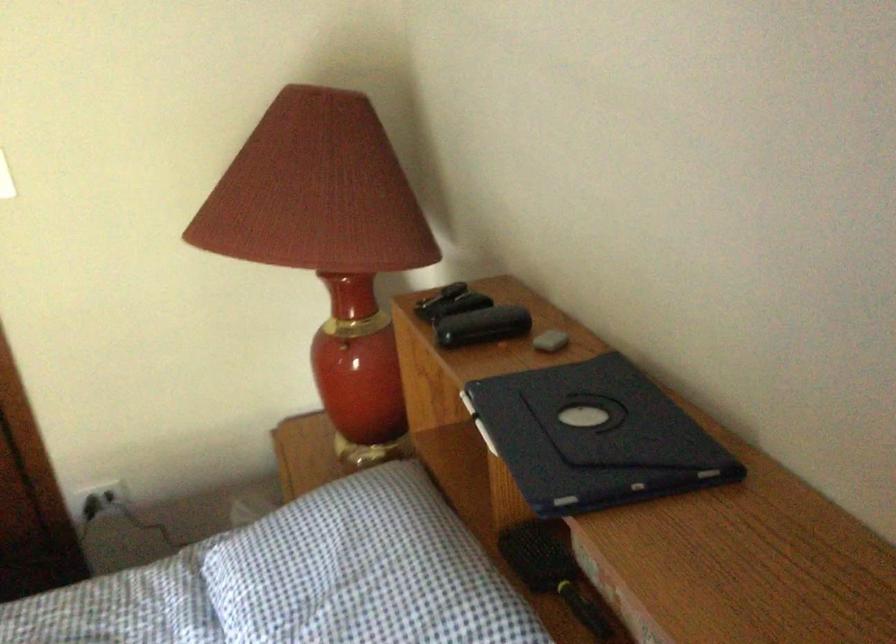
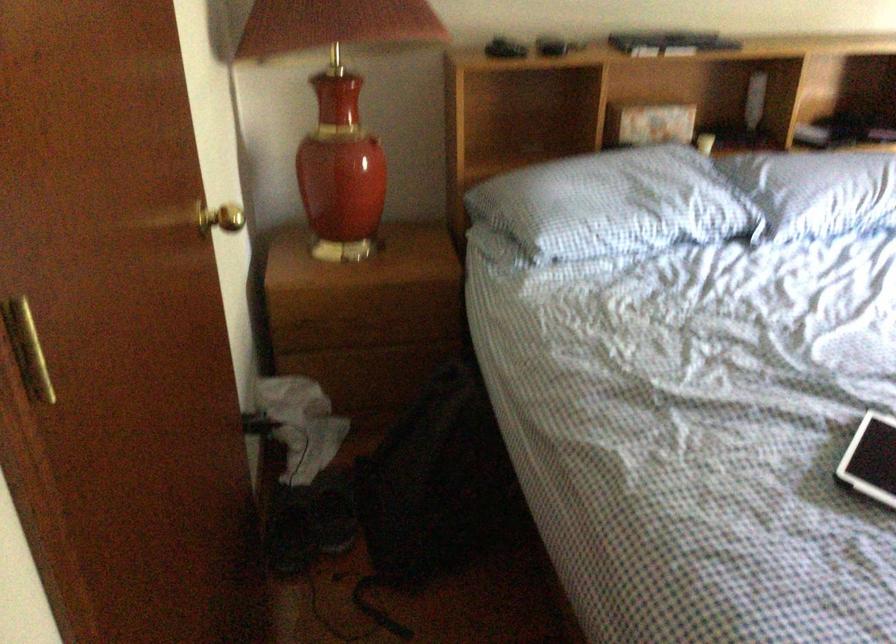
Question: I am providing you with two images of the same scene from different viewpoints. Which of the following objects are not visible in image2?

Choices:
 (A) small black tablet
 (B) blue checkered pillow
 (C) gold door knob
 (D) none of these

Answer: (D)